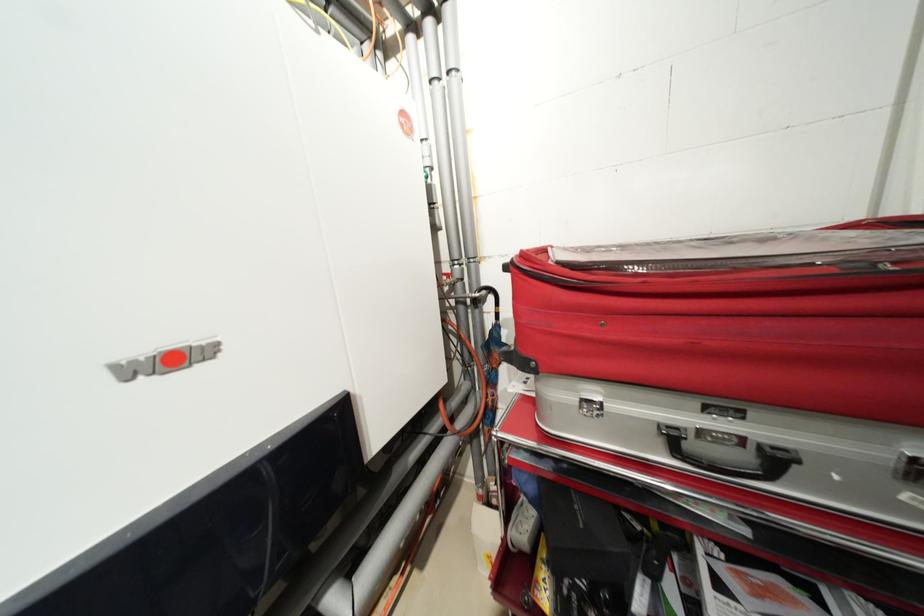
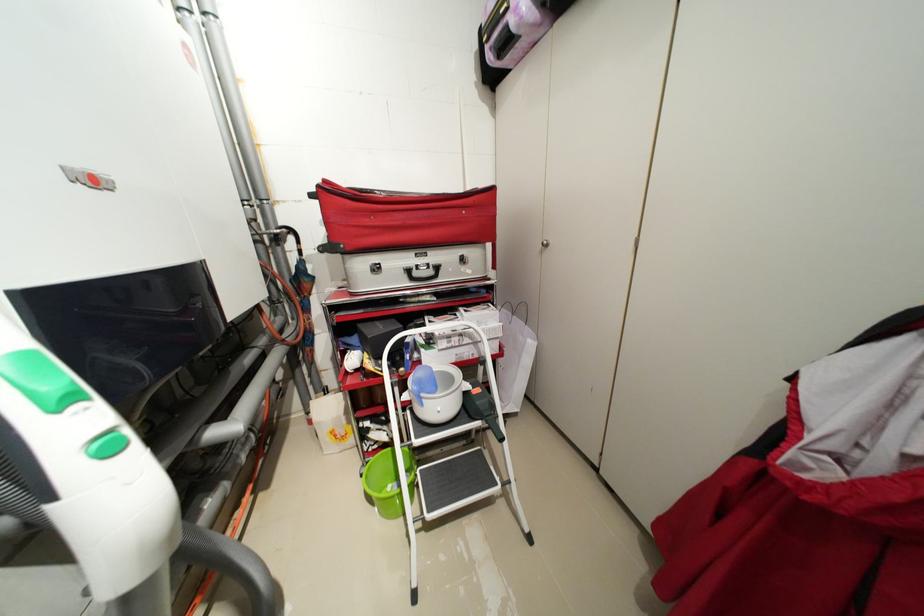
Where in the second image is the point corresponding to point 699,446 from the first image?

(422, 275)